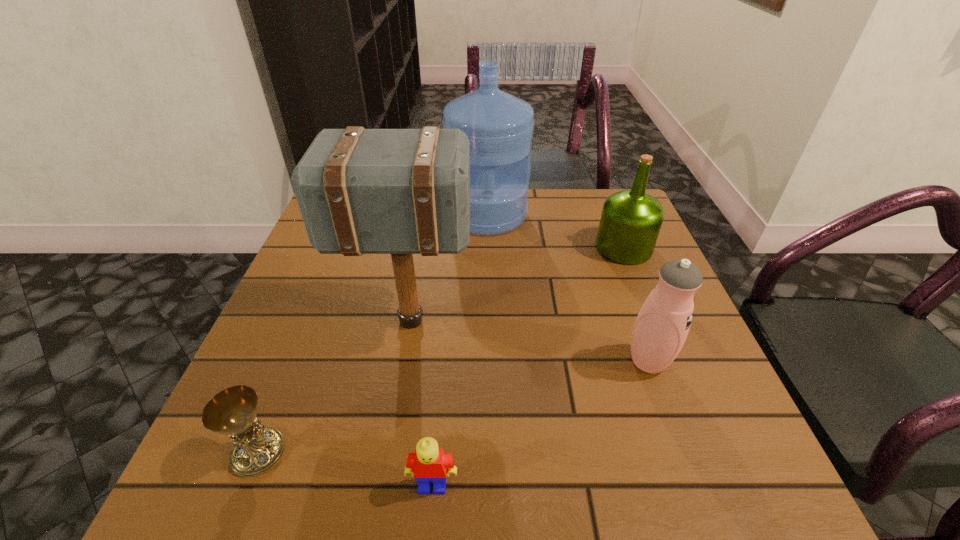
Locate an element on the screen. This screenshot has height=540, width=960. unoccupied area between the thermos bottle and the water jug is located at coordinates (567, 288).

The width and height of the screenshot is (960, 540). I want to click on vacant area that lies between the Lego and the leftmost object, so click(346, 469).

Identify the location of free space that is in between the thermos bottle and the leftmost object. The image size is (960, 540). [454, 407].

At what (x,y) coordinates should I click in order to perform the action: click on free space that is in between the mallet and the thermos bottle. Please return your answer as a coordinate pair (x, y). The height and width of the screenshot is (540, 960). Looking at the image, I should click on (529, 341).

Locate an element on the screen. The image size is (960, 540). unoccupied area between the thermos bottle and the water jug is located at coordinates (567, 288).

Identify the location of free spot between the mallet and the chalice. (334, 387).

Locate an element on the screen. vacant space that is in between the water jug and the mallet is located at coordinates (448, 268).

Identify the location of object that can be found as the third closest to the water jug. (662, 325).

Locate which object ranks second in proximity to the leftmost object. Please provide its 2D coordinates. Your answer should be formatted as a tuple, i.e. [(x, y)], where the tuple contains the x and y coordinates of a point satisfying the conditions above.

[(428, 464)]

Find the location of a particular element. free space that satisfies the following two spatial constraints: 1. on the striking surface of the mallet; 2. on the front side of the leftmost object is located at coordinates (388, 453).